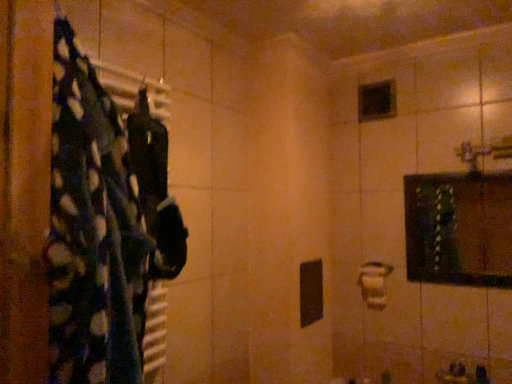
What do you see at coordinates (377, 100) in the screenshot? I see `black glass mirror at upper center` at bounding box center [377, 100].

The width and height of the screenshot is (512, 384). What do you see at coordinates (374, 290) in the screenshot?
I see `white matte toilet paper at center-right` at bounding box center [374, 290].

The height and width of the screenshot is (384, 512). In order to click on dark green fabric at left in this screenshot , I will do `click(108, 222)`.

From the picture: From a real-world perspective, between wooden framed mirror at upper right and black fabric at left, who is vertically higher?

From a 3D spatial view, black fabric at left is above.

Is wooden framed mirror at upper right positioned far away from black fabric at left?

Yes.

From the image's perspective, is wooden framed mirror at upper right on top of black fabric at left?

No, from the image's perspective, wooden framed mirror at upper right is not on top of black fabric at left.

Is wooden framed mirror at upper right shorter than black fabric at left?

Indeed, wooden framed mirror at upper right has a lesser height compared to black fabric at left.

Measure the distance from white matte toilet paper at center-right to wooden framed mirror at upper right.

white matte toilet paper at center-right is 29.43 inches away from wooden framed mirror at upper right.

Can you confirm if white matte toilet paper at center-right is shorter than wooden framed mirror at upper right?

Yes, white matte toilet paper at center-right is shorter than wooden framed mirror at upper right.

Does white matte toilet paper at center-right have a smaller size compared to wooden framed mirror at upper right?

Yes.

Locate an element on the screen. Image resolution: width=512 pixels, height=384 pixels. medicine cabinet that is above the white matte toilet paper at center-right (from the image's perspective) is located at coordinates (459, 228).

From the picture: In terms of height, does wooden framed mirror at upper right look taller or shorter compared to dark green fabric at left?

wooden framed mirror at upper right is shorter than dark green fabric at left.

Would you say wooden framed mirror at upper right is inside or outside dark green fabric at left?

The correct answer is: outside.

Considering the sizes of objects wooden framed mirror at upper right and dark green fabric at left in the image provided, who is bigger, wooden framed mirror at upper right or dark green fabric at left?

With larger size is dark green fabric at left.

Is wooden framed mirror at upper right oriented away from dark green fabric at left?

That's not correct — wooden framed mirror at upper right is not looking away from dark green fabric at left.

Would you say black glass mirror at upper center is outside black fabric at left?

black glass mirror at upper center is positioned outside black fabric at left.

From their relative heights in the image, would you say black glass mirror at upper center is taller or shorter than black fabric at left?

In the image, black glass mirror at upper center appears to be shorter than black fabric at left.

Can you tell me how much black glass mirror at upper center and black fabric at left differ in facing direction?

black glass mirror at upper center and black fabric at left are facing 92.3 degrees away from each other.

Between dark green fabric at left and wooden framed mirror at upper right, which one has more height?

dark green fabric at left.

From a real-world perspective, does dark green fabric at left stand above wooden framed mirror at upper right?

Correct, in the physical world, dark green fabric at left is higher than wooden framed mirror at upper right.

Which of these two, dark green fabric at left or wooden framed mirror at upper right, is bigger?

dark green fabric at left.

Would you say dark green fabric at left is a long distance from wooden framed mirror at upper right?

Yes, dark green fabric at left and wooden framed mirror at upper right are located far from each other.

From a real-world perspective, which object stands above the other?

In real-world perspective, black fabric at left is above.

Does black fabric at left have a lesser height compared to white matte toilet paper at center-right?

Incorrect, the height of black fabric at left does not fall short of that of white matte toilet paper at center-right.

Considering the relative sizes of black fabric at left and white matte toilet paper at center-right in the image provided, is black fabric at left smaller than white matte toilet paper at center-right?

No.

Could you tell me if black fabric at left is facing wooden framed mirror at upper right?

No, black fabric at left is not aimed at wooden framed mirror at upper right.

Which is further, (x=145, y=222) or (x=500, y=187)?

The point (x=500, y=187) is more distant.

Does black fabric at left lie behind wooden framed mirror at upper right?

No.

In the scene shown: Is black fabric at left placed right next to wooden framed mirror at upper right?

They are not placed beside each other.

Where is `clothing that is on the left side of wooden framed mirror at upper right`? The width and height of the screenshot is (512, 384). clothing that is on the left side of wooden framed mirror at upper right is located at coordinates (155, 226).

Locate an element on the screen. The height and width of the screenshot is (384, 512). medicine cabinet in front of the white matte toilet paper at center-right is located at coordinates (459, 228).

Which object lies nearer to the anchor point white matte toilet paper at center-right, black fabric at left or dark green fabric at left?

black fabric at left is closer to white matte toilet paper at center-right.

Estimate the real-world distances between objects in this image. Which object is further from white matte toilet paper at center-right, black glass mirror at upper center or black fabric at left?

black fabric at left is further to white matte toilet paper at center-right.

Looking at the image, which one is located further to white matte toilet paper at center-right, dark green fabric at left or black glass mirror at upper center?

The object further to white matte toilet paper at center-right is dark green fabric at left.

Considering their positions, is dark green fabric at left positioned closer to wooden framed mirror at upper right than white matte toilet paper at center-right?

white matte toilet paper at center-right.

Which object lies further to the anchor point white matte toilet paper at center-right, dark green fabric at left or wooden framed mirror at upper right?

dark green fabric at left is positioned further to the anchor white matte toilet paper at center-right.

Considering their positions, is dark green fabric at left positioned further to black glass mirror at upper center than white matte toilet paper at center-right?

dark green fabric at left lies further to black glass mirror at upper center than the other object.

When comparing their distances from white matte toilet paper at center-right, does wooden framed mirror at upper right or dark green fabric at left seem closer?

wooden framed mirror at upper right is positioned closer to the anchor white matte toilet paper at center-right.

When comparing their distances from white matte toilet paper at center-right, does wooden framed mirror at upper right or black fabric at left seem further?

black fabric at left is positioned further to the anchor white matte toilet paper at center-right.

In order to click on clothing positioned between dark green fabric at left and white matte toilet paper at center-right from near to far in this screenshot , I will do click(x=155, y=226).

Locate an element on the screen. Image resolution: width=512 pixels, height=384 pixels. toilet paper between black fabric at left and wooden framed mirror at upper right in the horizontal direction is located at coordinates (374, 290).

What are the coordinates of `toilet paper between black fabric at left and black glass mirror at upper center in the front-back direction` in the screenshot? It's located at (374, 290).

The image size is (512, 384). Identify the location of clothing positioned between dark green fabric at left and black glass mirror at upper center from near to far. (155, 226).